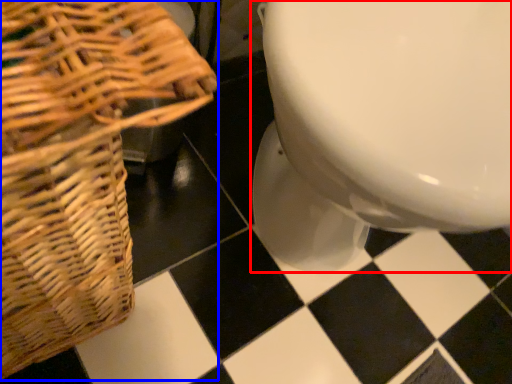
Question: Which point is closer to the camera, toilet (highlighted by a red box) or picnic basket (highlighted by a blue box)?

Choices:
 (A) toilet
 (B) picnic basket

Answer: (B)